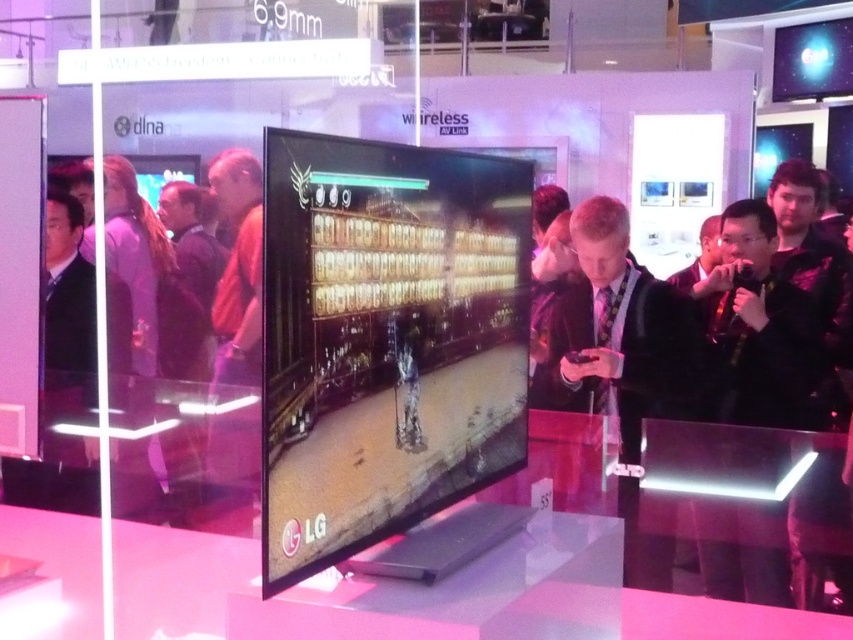
Does black matte jacket at right have a smaller size compared to black suit at center?

Yes, black matte jacket at right is smaller than black suit at center.

Which is in front, point (769, 241) or point (624, 358)?

Point (624, 358) is more forward.

The height and width of the screenshot is (640, 853). I want to click on black matte jacket at right, so click(756, 326).

At what (x,y) coordinates should I click in order to perform the action: click on black matte jacket at right. Please return your answer as a coordinate pair (x, y). This screenshot has height=640, width=853. Looking at the image, I should click on (756, 326).